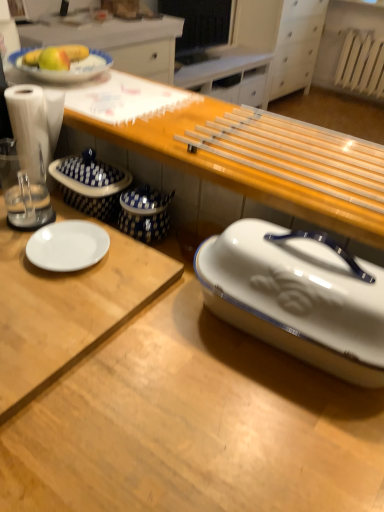
In order to click on vacant space that's between white glossy plate at left, which is the 2th desk from bottom to top, and white glossy breadbox at lower right in this screenshot , I will do `click(198, 374)`.